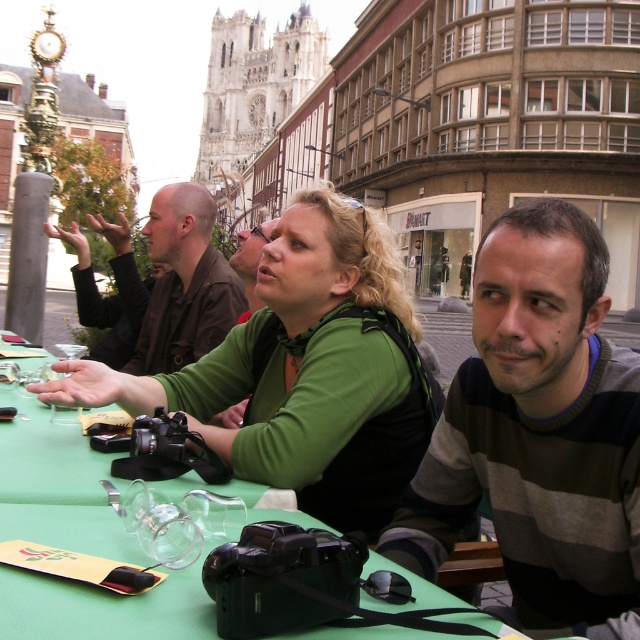
Question: Can you confirm if striped sweater at center is positioned below transparent glass wine glass at center?

Choices:
 (A) yes
 (B) no

Answer: (A)

Question: Which object is farther from the camera taking this photo?

Choices:
 (A) green fabric table at center
 (B) striped sweater at center
 (C) green matte shirt at center
 (D) transparent glass wine glass at center

Answer: (D)

Question: Where is green fabric table at center located in relation to transparent glass wine glass at center in the image?

Choices:
 (A) right
 (B) left

Answer: (A)

Question: Which point appears farthest from the camera in this image?

Choices:
 (A) (445, 467)
 (B) (157, 248)
 (C) (196, 397)

Answer: (B)

Question: Is green matte shirt at center to the right of brown leather jacket at upper left from the viewer's perspective?

Choices:
 (A) no
 (B) yes

Answer: (B)

Question: Which object is positioned farthest from the green fabric table at center?

Choices:
 (A) green matte shirt at center
 (B) striped sweater at center

Answer: (B)